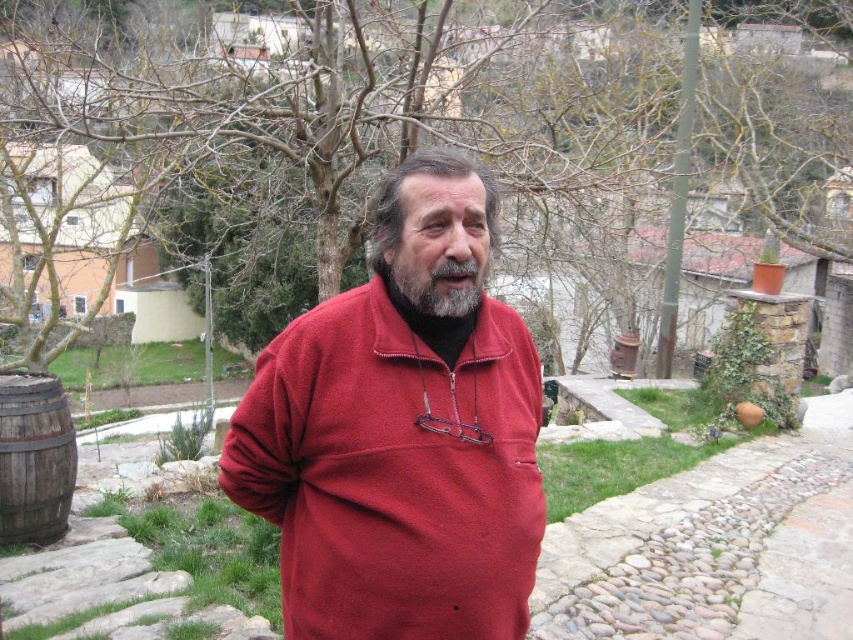
Who is taller, matte fleece pullover at center or graywoollybeard at center?

matte fleece pullover at center is taller.

Can you confirm if matte fleece pullover at center is smaller than graywoollybeard at center?

No.

This screenshot has width=853, height=640. Find the location of `matte fleece pullover at center`. matte fleece pullover at center is located at coordinates (399, 440).

Find the location of a particular element. The image size is (853, 640). matte fleece pullover at center is located at coordinates (399, 440).

Is point (670, 84) closer to camera compared to point (376, 609)?

No, it is behind (376, 609).

Is point (703, 172) farther from camera compared to point (372, 308)?

Yes, it is behind point (372, 308).

Where is `bare branches at upper center`? bare branches at upper center is located at coordinates (364, 132).

You are a GUI agent. You are given a task and a screenshot of the screen. Output one action in this format:
    pyautogui.click(x=<x>, y=<y>)
    Task: Click on the bare branches at upper center
    Image resolution: width=853 pixels, height=640 pixels.
    Given the screenshot: What is the action you would take?
    pyautogui.click(x=364, y=132)

Between bare branches at upper center and gray matte hair at center, which one appears on the left side from the viewer's perspective?

A: From the viewer's perspective, gray matte hair at center appears more on the left side.

Is bare branches at upper center to the left of gray matte hair at center from the viewer's perspective?

In fact, bare branches at upper center is to the right of gray matte hair at center.

Find the location of a particular element. This screenshot has height=640, width=853. bare branches at upper center is located at coordinates (364, 132).